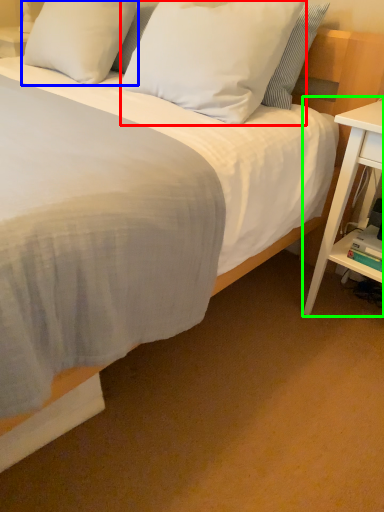
Question: Which is farther away from pillow (highlighted by a red box)? pillow (highlighted by a blue box) or nightstand (highlighted by a green box)?

Choices:
 (A) pillow
 (B) nightstand

Answer: (B)